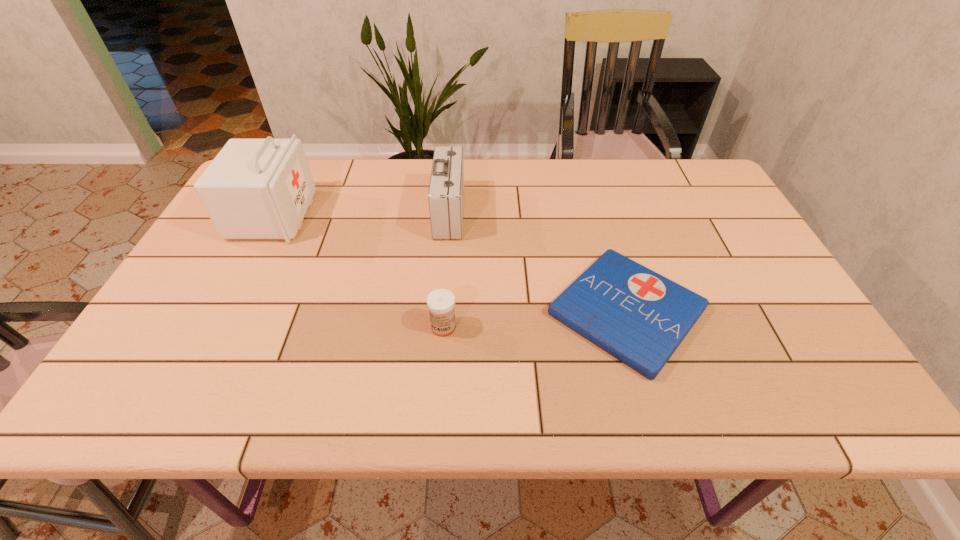
At what (x,y) coordinates should I click in order to perform the action: click on the leftmost object. Please return your answer as a coordinate pair (x, y). The height and width of the screenshot is (540, 960). Looking at the image, I should click on (255, 188).

Where is `the leftmost first-aid kit`? the leftmost first-aid kit is located at coordinates (255, 188).

This screenshot has height=540, width=960. In order to click on the second first-aid kit from right to left in this screenshot , I will do [446, 189].

The height and width of the screenshot is (540, 960). In order to click on the third shortest object in this screenshot , I will do `click(446, 189)`.

You are a GUI agent. You are given a task and a screenshot of the screen. Output one action in this format:
    pyautogui.click(x=<x>, y=<y>)
    Task: Click on the medicine
    
    Given the screenshot: What is the action you would take?
    pyautogui.click(x=441, y=302)

Find the location of a particular element. the shortest object is located at coordinates (638, 316).

Find the location of `the shortest first-aid kit`. the shortest first-aid kit is located at coordinates (638, 316).

Identify the location of vacant region located on the front-facing side of the leftmost object. This screenshot has height=540, width=960. (360, 215).

Find the location of a particular element. The image size is (960, 540). blank area located on the front-facing side of the second first-aid kit from right to left is located at coordinates (543, 213).

Where is `free space located on the left of the second shortest object`? free space located on the left of the second shortest object is located at coordinates (259, 327).